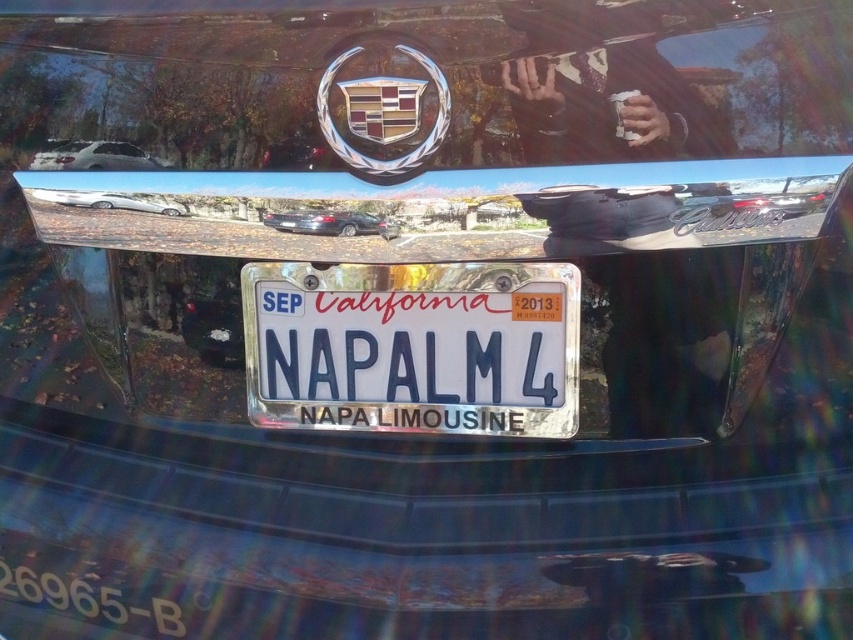
Question: Does white glossy sedan at upper left have a smaller size compared to shiny black sedan at center?

Choices:
 (A) no
 (B) yes

Answer: (A)

Question: Which point is farther from the camera taking this photo?

Choices:
 (A) (129, 148)
 (B) (543, 362)
 (C) (366, 212)

Answer: (B)

Question: Which of the following is the closest to the observer?

Choices:
 (A) white glossy sedan at upper left
 (B) silver metallic car at upper left

Answer: (B)

Question: Among these objects, which one is farthest from the camera?

Choices:
 (A) silver metallic car at upper left
 (B) white glossy sedan at upper left

Answer: (B)

Question: Does white glossy sedan at upper left appear on the right side of silver metallic car at upper left?

Choices:
 (A) no
 (B) yes

Answer: (A)

Question: Does silver metallic license plate at center appear over silver metallic car at upper left?

Choices:
 (A) yes
 (B) no

Answer: (B)